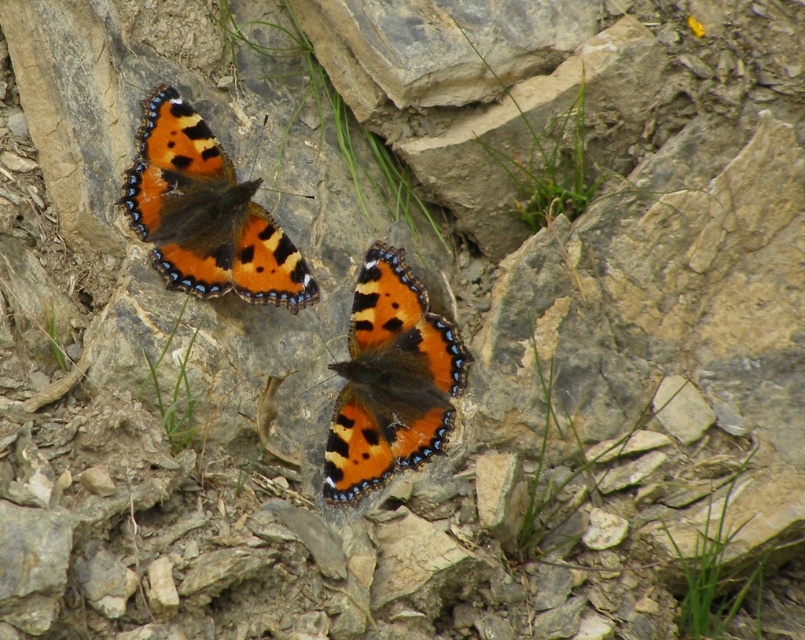
Is orange matte butterfly at upper left further to the viewer compared to orange matte butterfly at center?

Yes, it is.

Does orange matte butterfly at upper left appear on the right side of orange matte butterfly at center?

Incorrect, orange matte butterfly at upper left is not on the right side of orange matte butterfly at center.

Measure the distance between orange matte butterfly at upper left and camera.

A distance of 1.53 meters exists between orange matte butterfly at upper left and camera.

What are the coordinates of `orange matte butterfly at upper left` in the screenshot? It's located at (205, 212).